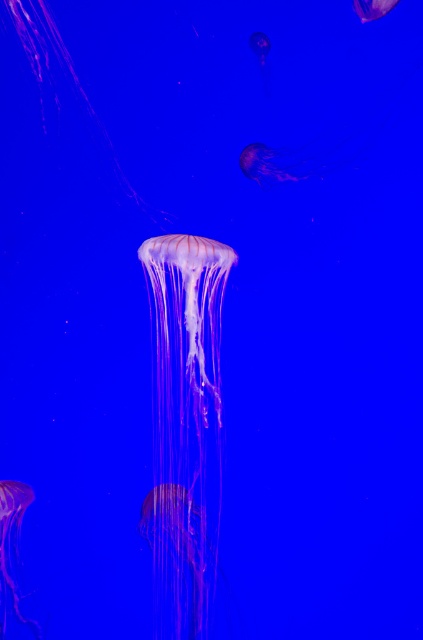
Question: Which point is closer to the camera taking this photo?

Choices:
 (A) 10,515
 (B) 264,38
 (C) 291,173
 (D) 357,3

Answer: (A)

Question: Which is nearer to the translucent purple jellyfish at upper right?

Choices:
 (A) translucent pink jellyfish at center
 (B) translucent pink jellyfish at lower left
 (C) translucent pink jellyfish at upper center
 (D) translucent purple jellyfish at center

Answer: (D)

Question: Which of the following is the farthest from the observer?

Choices:
 (A) (373, 17)
 (B) (258, 42)

Answer: (B)

Question: Can you confirm if translucent pink jellyfish at center is bigger than translucent purple jellyfish at upper right?

Choices:
 (A) yes
 (B) no

Answer: (A)

Question: Is translucent pink jellyfish at lower left to the right of translucent pink jellyfish at upper center from the viewer's perspective?

Choices:
 (A) no
 (B) yes

Answer: (A)

Question: Can you confirm if translucent pink jellyfish at lower left is positioned above translucent purple jellyfish at center?

Choices:
 (A) yes
 (B) no

Answer: (B)